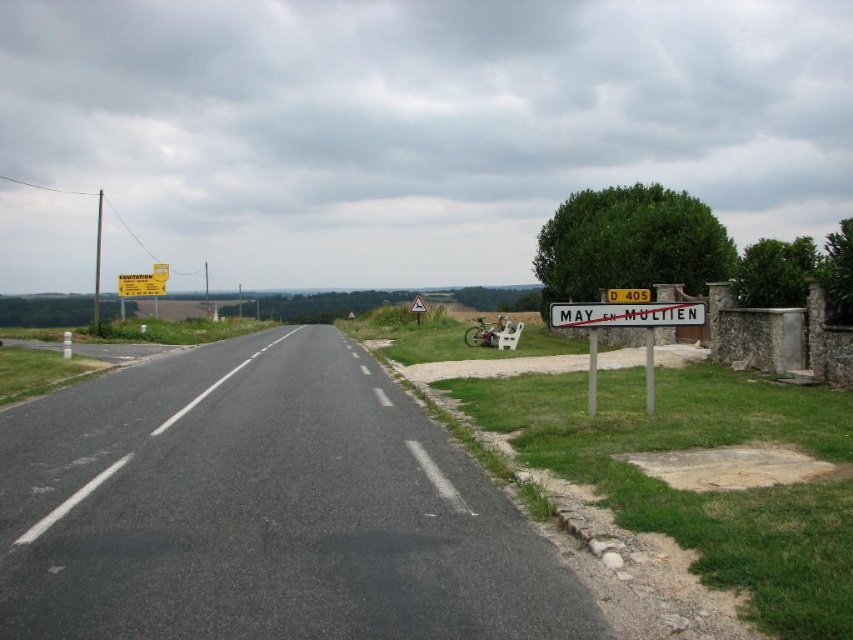
You are a cyclist planning to ride from the bicycle parked near the sign to the black asphalt road at center. Which direction should you head relative to the white plastic street sign at right?

You should head to the left of the white plastic street sign at right to reach the black asphalt road at center.

You are driving a car that is 15 feet long. You see the black asphalt road at center and need to park your car parallel to it. Is there enough space between the road and the signpost to park your car?

The distance between the black asphalt road at center and the signpost is 12.67 feet, which is less than the car length of 15 feet. Therefore, there isn not enough space to park the car parallel to the road.

You are a pedestrian standing at point (596, 321) and want to walk to point (653, 333). Given the road is two lanes wide, can you safely cross the road without crossing any lanes?

Point (653, 333) is in front of point (596, 321), so yes, you can safely cross the road to reach point (653, 333) without needing to cross any lanes, as it is ahead in your path.